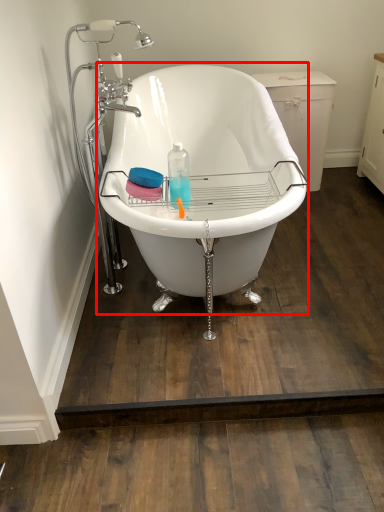
Question: From the image's perspective, what is the correct spatial positioning of bathtub (annotated by the red box) in reference to faucet?

Choices:
 (A) above
 (B) below

Answer: (B)